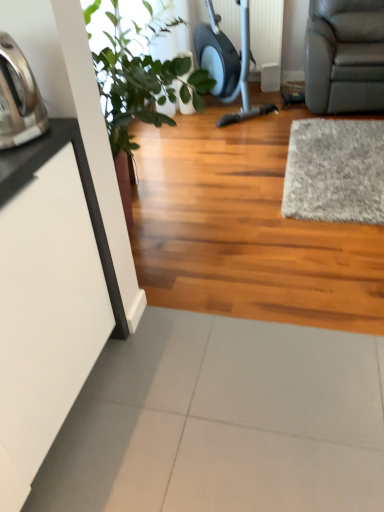
What do you see at coordinates (18, 98) in the screenshot? I see `brushed metal kettle at left` at bounding box center [18, 98].

Locate an element on the screen. The width and height of the screenshot is (384, 512). green leafy plant at upper left is located at coordinates (135, 79).

Image resolution: width=384 pixels, height=512 pixels. Find the location of `brushed metal kettle at left`. brushed metal kettle at left is located at coordinates (18, 98).

Can you confirm if green leafy plant at upper left is taller than brushed metal kettle at left?

Indeed, green leafy plant at upper left has a greater height compared to brushed metal kettle at left.

Would you consider green leafy plant at upper left to be distant from brushed metal kettle at left?

No, green leafy plant at upper left is not far from brushed metal kettle at left.

Which is in front, point (150, 114) or point (35, 90)?

Positioned in front is point (35, 90).

Who is more distant, green leafy plant at upper left or brushed metal kettle at left?

Positioned behind is green leafy plant at upper left.

Is gray shaggy rug at right oriented towards brushed metal kettle at left?

No, gray shaggy rug at right does not turn towards brushed metal kettle at left.

Is gray shaggy rug at right smaller than brushed metal kettle at left?

Incorrect, gray shaggy rug at right is not smaller in size than brushed metal kettle at left.

Between gray shaggy rug at right and brushed metal kettle at left, which one is positioned behind?

gray shaggy rug at right.

Is gray shaggy rug at right shorter than brushed metal kettle at left?

Correct, gray shaggy rug at right is not as tall as brushed metal kettle at left.

Based on the photo, is brushed metal kettle at left aimed at green leafy plant at upper left?

No, brushed metal kettle at left is not aimed at green leafy plant at upper left.

Do you think brushed metal kettle at left is within green leafy plant at upper left, or outside of it?

The correct answer is: outside.

From the image's perspective, is brushed metal kettle at left positioned above or below green leafy plant at upper left?

brushed metal kettle at left is situated lower than green leafy plant at upper left in the image.

From the image's perspective, is brushed metal kettle at left beneath gray shaggy rug at right?

Indeed, from the image's perspective, brushed metal kettle at left is shown beneath gray shaggy rug at right.

Is point (13, 108) closer or farther from the camera than point (368, 196)?

Point (13, 108).

Does brushed metal kettle at left have a smaller size compared to gray shaggy rug at right?

Indeed, brushed metal kettle at left has a smaller size compared to gray shaggy rug at right.

Which object is closer to the camera, green leafy plant at upper left or gray shaggy rug at right?

green leafy plant at upper left is more forward.

Is the surface of green leafy plant at upper left in direct contact with gray shaggy rug at right?

No.

From a real-world perspective, is green leafy plant at upper left above or below gray shaggy rug at right?

From a real-world perspective, green leafy plant at upper left is physically above gray shaggy rug at right.

In the image, is green leafy plant at upper left on the left side or the right side of gray shaggy rug at right?

From the image, it's evident that green leafy plant at upper left is to the left of gray shaggy rug at right.

What's the angular difference between gray shaggy rug at right and green leafy plant at upper left's facing directions?

gray shaggy rug at right and green leafy plant at upper left are facing 118 degrees away from each other.

Which is farther, (299, 158) or (126, 42)?

The point (299, 158) is farther.

From the image's perspective, between gray shaggy rug at right and green leafy plant at upper left, which one is located above?

green leafy plant at upper left is shown above in the image.

Which of these two, gray shaggy rug at right or green leafy plant at upper left, stands taller?

green leafy plant at upper left is taller.

Locate an element on the screen. The width and height of the screenshot is (384, 512). houseplant located behind the brushed metal kettle at left is located at coordinates (135, 79).

You are a GUI agent. You are given a task and a screenshot of the screen. Output one action in this format:
    pyautogui.click(x=<x>, y=<y>)
    Task: Click on the appliance positioned vertically above the gray shaggy rug at right (from a real-world perspective)
    
    Given the screenshot: What is the action you would take?
    [x=18, y=98]

Considering their positions, is gray shaggy rug at right positioned further to green leafy plant at upper left than brushed metal kettle at left?

gray shaggy rug at right lies further to green leafy plant at upper left than the other object.

When comparing their distances from brushed metal kettle at left, does green leafy plant at upper left or gray shaggy rug at right seem further?

gray shaggy rug at right.

From the image, which object appears to be farther from gray shaggy rug at right, brushed metal kettle at left or green leafy plant at upper left?

brushed metal kettle at left lies further to gray shaggy rug at right than the other object.

When comparing their distances from gray shaggy rug at right, does green leafy plant at upper left or brushed metal kettle at left seem closer?

The object closer to gray shaggy rug at right is green leafy plant at upper left.

Considering their positions, is brushed metal kettle at left positioned closer to green leafy plant at upper left than gray shaggy rug at right?

Based on the image, brushed metal kettle at left appears to be nearer to green leafy plant at upper left.

Based on their spatial positions, is gray shaggy rug at right or green leafy plant at upper left closer to brushed metal kettle at left?

green leafy plant at upper left is positioned closer to the anchor brushed metal kettle at left.

This screenshot has width=384, height=512. Find the location of `houseplant between brushed metal kettle at left and gray shaggy rug at right from left to right`. houseplant between brushed metal kettle at left and gray shaggy rug at right from left to right is located at coordinates (135, 79).